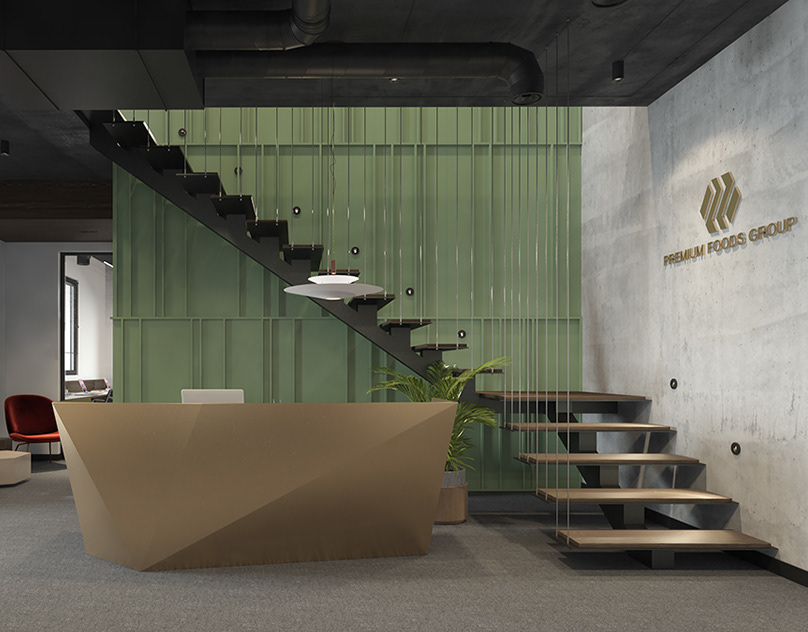
Where is `chair`? Image resolution: width=808 pixels, height=632 pixels. chair is located at coordinates (26, 416).